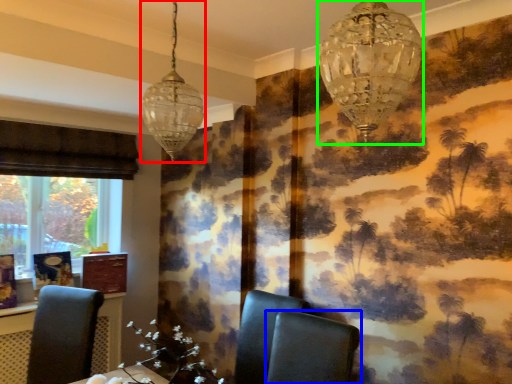
Question: Estimate the real-world distances between objects in this image. Which object is farther from lamp (highlighted by a red box), chair (highlighted by a blue box) or lamp (highlighted by a green box)?

Choices:
 (A) chair
 (B) lamp

Answer: (A)